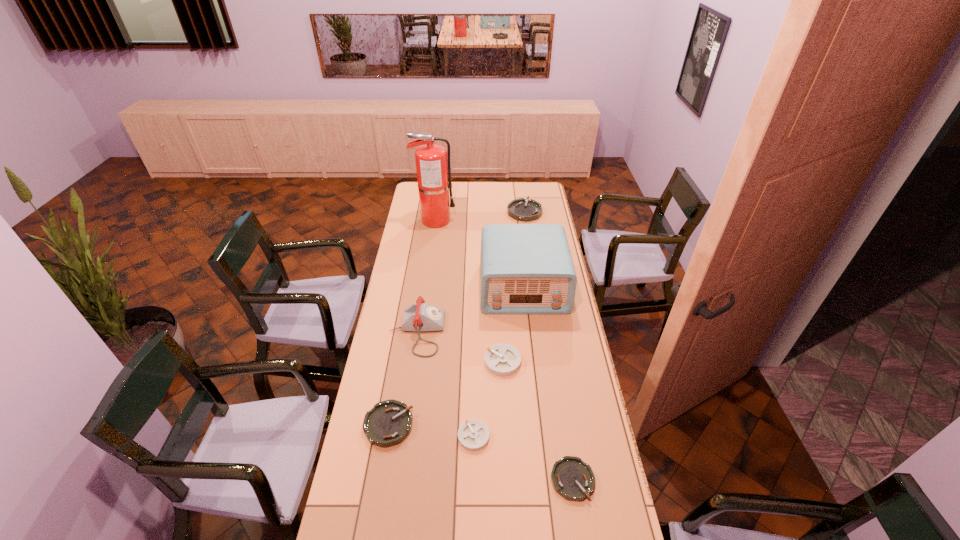
Identify which ashtray is the fifth closest to the red fire extinguisher. Please provide its 2D coordinates. Your answer should be formatted as a tuple, i.e. [(x, y)], where the tuple contains the x and y coordinates of a point satisfying the conditions above.

[(573, 479)]

You are a GUI agent. You are given a task and a screenshot of the screen. Output one action in this format:
    pyautogui.click(x=<x>, y=<y>)
    Task: Click on the ashtray that is the third closest to the farther gray ashtray
    
    Given the screenshot: What is the action you would take?
    pyautogui.click(x=573, y=479)

Select which green ashtray appears as the closest to the telephone. Please provide its 2D coordinates. Your answer should be formatted as a tuple, i.e. [(x, y)], where the tuple contains the x and y coordinates of a point satisfying the conditions above.

[(388, 423)]

Identify which green ashtray is the third closest to the tallest object. Please provide its 2D coordinates. Your answer should be formatted as a tuple, i.e. [(x, y)], where the tuple contains the x and y coordinates of a point satisfying the conditions above.

[(573, 479)]

Locate an element on the screen. This screenshot has width=960, height=540. vacant space that satisfies the following two spatial constraints: 1. on the back side of the bigger gray ashtray; 2. on the right side of the smaller gray ashtray is located at coordinates (474, 362).

Image resolution: width=960 pixels, height=540 pixels. In order to click on vacant region that satisfies the following two spatial constraints: 1. at the nozzle of the fire extinguisher; 2. on the front side of the leftmost ashtray in this screenshot , I will do `click(407, 425)`.

In order to click on free location that satisfies the following two spatial constraints: 1. on the back side of the smaller gray ashtray; 2. on the dial of the red telephone in this screenshot , I will do `click(475, 332)`.

You are a GUI agent. You are given a task and a screenshot of the screen. Output one action in this format:
    pyautogui.click(x=<x>, y=<y>)
    Task: Click on the vacant region that satisfies the following two spatial constraints: 1. at the nozzle of the nearest object; 2. on the right side of the tallest object
    Image resolution: width=960 pixels, height=540 pixels.
    Given the screenshot: What is the action you would take?
    pyautogui.click(x=399, y=480)

I want to click on blank area in the image that satisfies the following two spatial constraints: 1. on the dial of the sixth shortest object; 2. on the right side of the nearer gray ashtray, so click(x=401, y=436).

This screenshot has height=540, width=960. I want to click on free point that satisfies the following two spatial constraints: 1. on the dial of the bigger gray ashtray; 2. on the left side of the red telephone, so click(x=412, y=362).